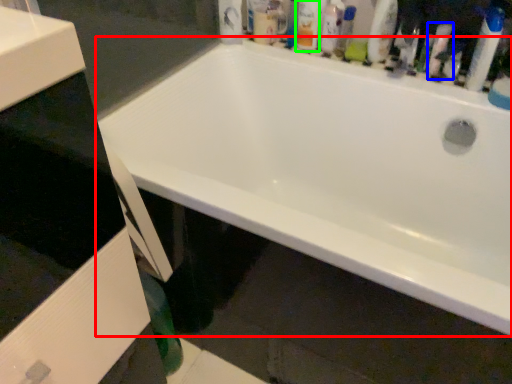
Question: Considering the real-world distances, which object is closest to bathtub (highlighted by a red box)? cleaning product (highlighted by a blue box) or toiletry (highlighted by a green box).

Choices:
 (A) cleaning product
 (B) toiletry

Answer: (B)